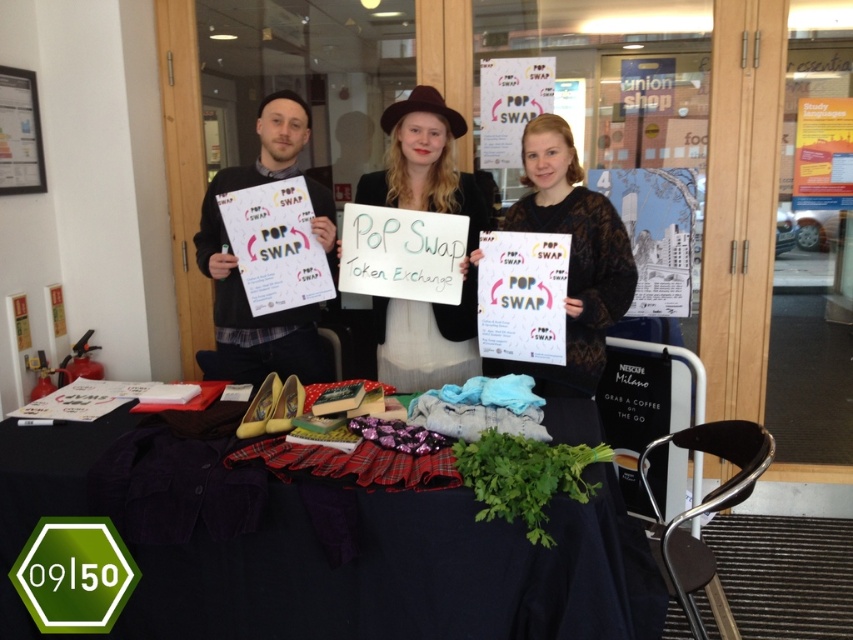
Question: Where is matte black hat at center located in relation to matte black sweater at center in the image?

Choices:
 (A) below
 (B) above

Answer: (B)

Question: Can you confirm if matte black hat at center is positioned to the left of matte black sweater at center?

Choices:
 (A) no
 (B) yes

Answer: (B)

Question: Based on their relative distances, which object is nearer to the matte black sweater at center?

Choices:
 (A) matte black hat at center
 (B) velvet fabric table at center

Answer: (A)

Question: Estimate the real-world distances between objects in this image. Which object is closer to the matte black poster at center?

Choices:
 (A) matte black sweater at center
 (B) matte black hat at center
 (C) velvet fabric table at center

Answer: (B)

Question: Which point appears farthest from the camera in this image?

Choices:
 (A) (x=138, y=518)
 (B) (x=599, y=369)
 (C) (x=281, y=353)
 (D) (x=410, y=97)

Answer: (C)

Question: Does velvet fabric table at center have a lesser width compared to matte black sweater at center?

Choices:
 (A) no
 (B) yes

Answer: (A)